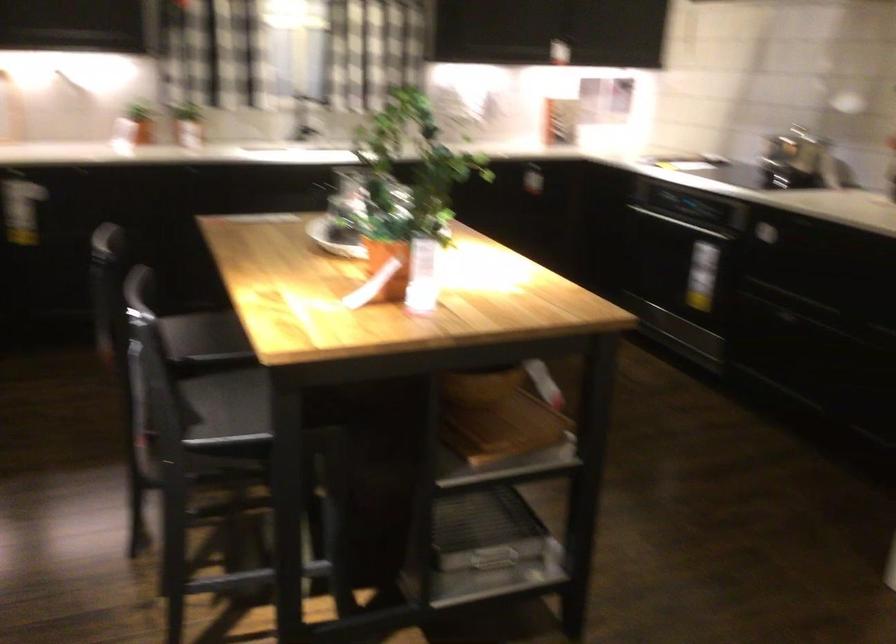
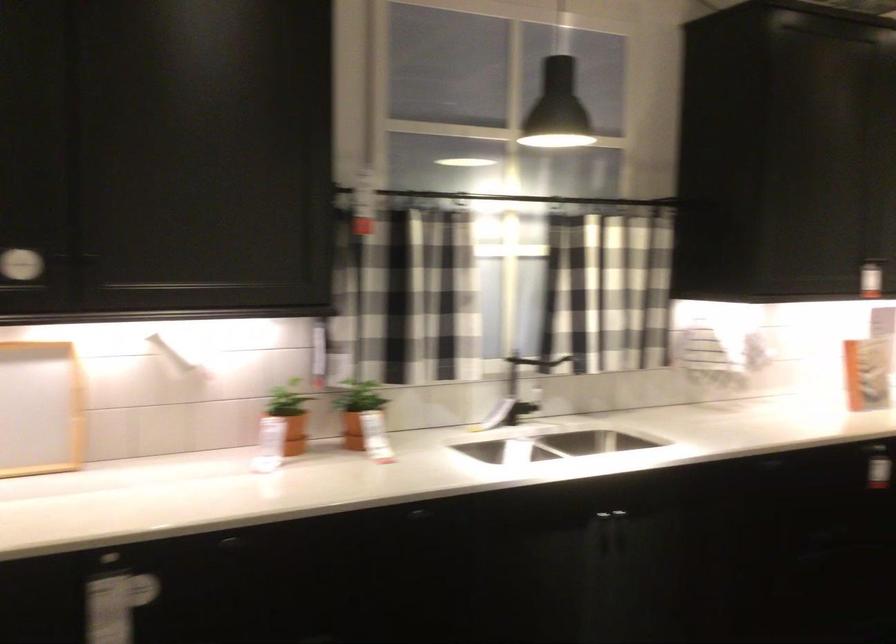
Locate, in the second image, the point that corresponds to point (143, 116) in the first image.

(289, 415)